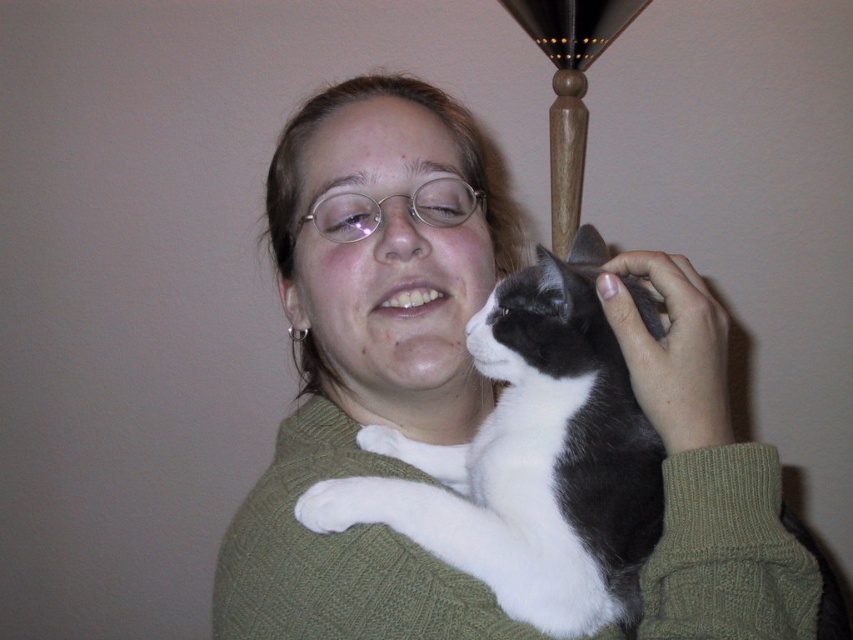
From the picture: Who is positioned more to the right, green knitted sweater at center or white and gray fur cat at center?

white and gray fur cat at center

Who is higher up, green knitted sweater at center or white and gray fur cat at center?

white and gray fur cat at center is higher up.

Is point (619, 288) farther from camera compared to point (466, 528)?

Yes, it is.

You are a GUI agent. You are given a task and a screenshot of the screen. Output one action in this format:
    pyautogui.click(x=<x>, y=<y>)
    Task: Click on the green knitted sweater at center
    The height and width of the screenshot is (640, 853).
    Given the screenshot: What is the action you would take?
    pyautogui.click(x=369, y=365)

Does green knitted sweater at center have a smaller size compared to wooden lampshade at upper center?

No, green knitted sweater at center is not smaller than wooden lampshade at upper center.

Is point (305, 579) positioned in front of point (589, 58)?

Yes.

Which is behind, point (405, 221) or point (560, 202)?

Positioned behind is point (560, 202).

Image resolution: width=853 pixels, height=640 pixels. Find the location of `green knitted sweater at center`. green knitted sweater at center is located at coordinates (369, 365).

Who is positioned more to the left, white and gray fur cat at center or wooden lampshade at upper center?

From the viewer's perspective, white and gray fur cat at center appears more on the left side.

Who is more forward, (601,321) or (556,140)?

Point (601,321) is more forward.

Between point (485, 480) and point (569, 157), which one is positioned in front?

Point (485, 480) is in front.

Where is `white and gray fur cat at center`? The width and height of the screenshot is (853, 640). white and gray fur cat at center is located at coordinates coord(531,460).